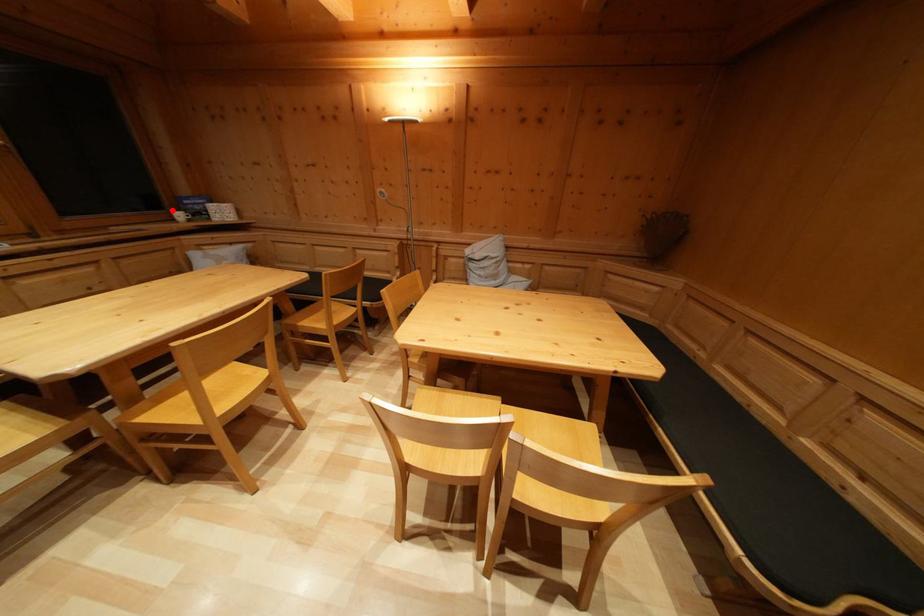
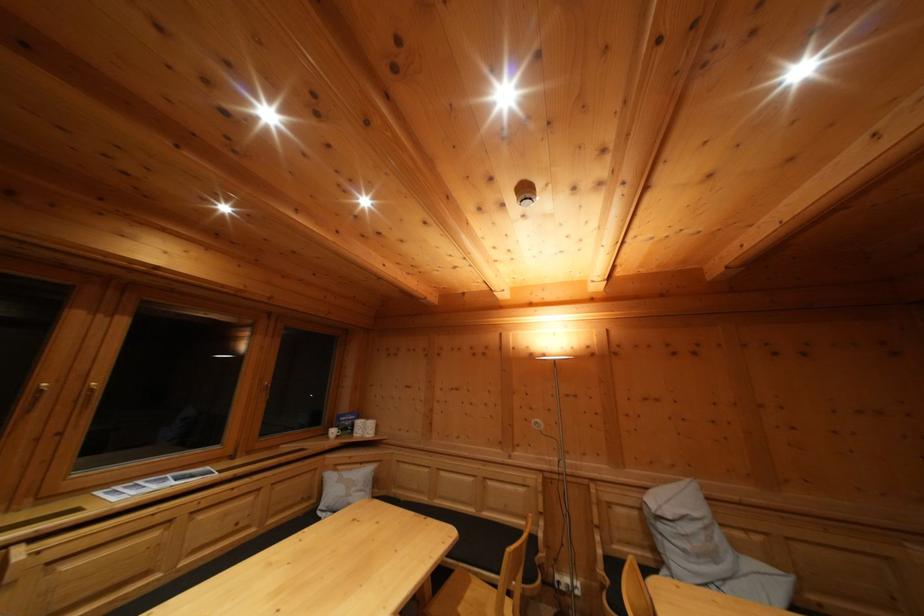
Question: I am providing you with two images of the same scene from different viewpoints. Given a red point in image1, look at the same physical point in image2. Is it:

Choices:
 (A) Closer to the viewpoint
 (B) Farther from the viewpoint

Answer: (B)